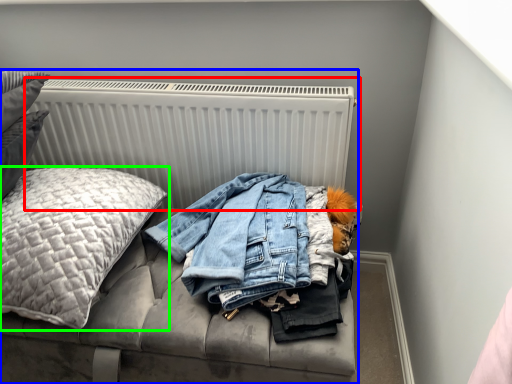
Question: Which object is the closest to the radiator (highlighted by a red box)? Choose among these: furniture (highlighted by a blue box) or pillow (highlighted by a green box).

Choices:
 (A) furniture
 (B) pillow

Answer: (A)